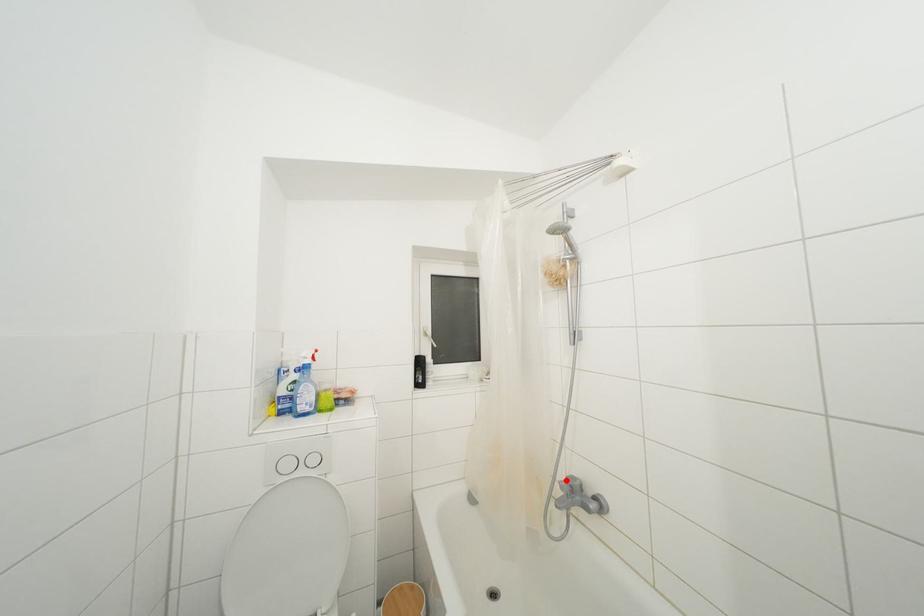
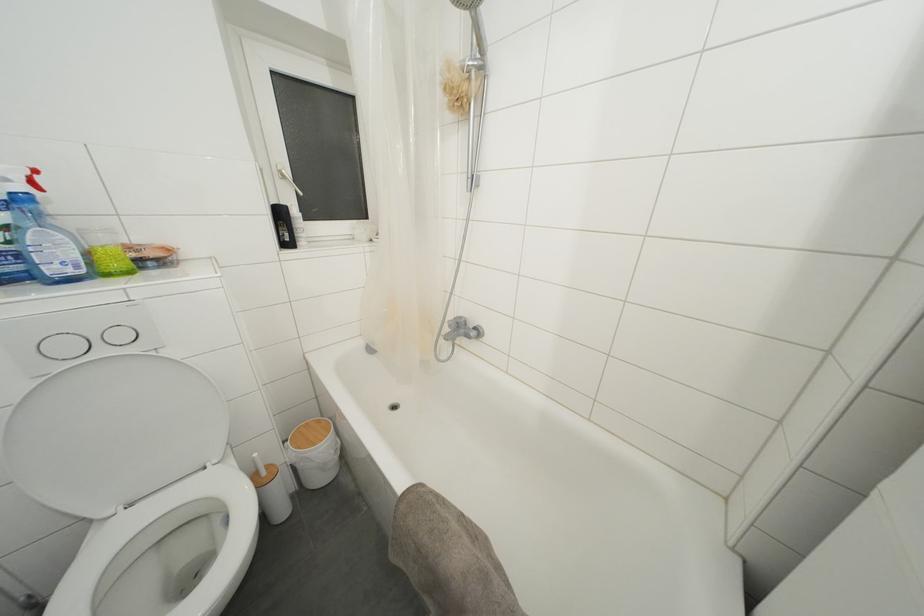
Question: I am providing you with two images of the same scene from different viewpoints. In image1, a red point is highlighted. Considering the same 3D point in image2, which of the following is correct?

Choices:
 (A) It is closer
 (B) It is farther

Answer: (A)